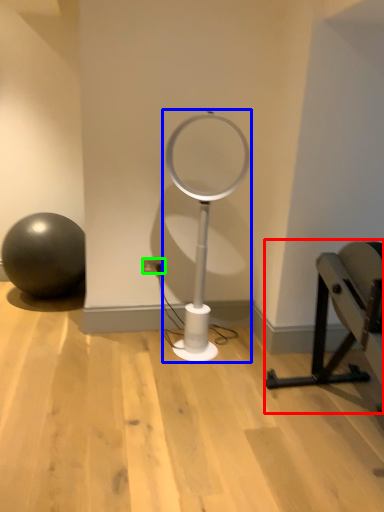
Question: Considering the real-world distances, which object is farthest from furniture (highlighted by a red box)? table lamp (highlighted by a blue box) or electric outlet (highlighted by a green box)?

Choices:
 (A) table lamp
 (B) electric outlet

Answer: (B)